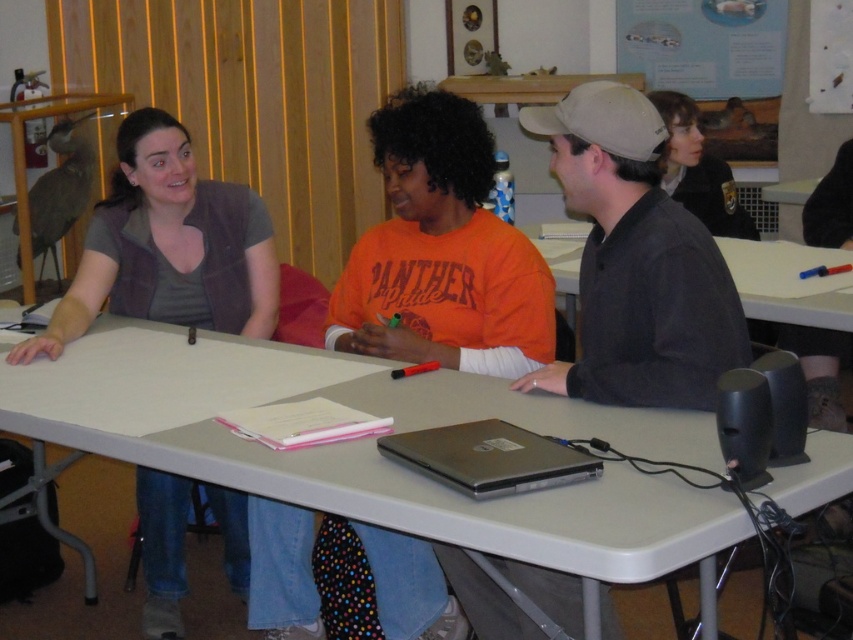
Question: Does matte plastic table at center have a lesser width compared to matte black jacket at upper right?

Choices:
 (A) no
 (B) yes

Answer: (A)

Question: Among these objects, which one is farthest from the camera?

Choices:
 (A) matte black jacket at upper right
 (B) white plastic table at center
 (C) matte gray vest at left

Answer: (A)

Question: Is dark gray shirt at center thinner than matte gray vest at left?

Choices:
 (A) yes
 (B) no

Answer: (A)

Question: Which object is farther from the camera taking this photo?

Choices:
 (A) matte gray vest at left
 (B) matte plastic table at center
 (C) silver metallic laptop at center

Answer: (A)

Question: Which point is closer to the camera taking this photo?

Choices:
 (A) (134, 236)
 (B) (584, 164)
 (C) (822, 312)
 (D) (421, 412)

Answer: (D)

Question: Is matte gray vest at left thinner than silver metallic laptop at center?

Choices:
 (A) no
 (B) yes

Answer: (A)